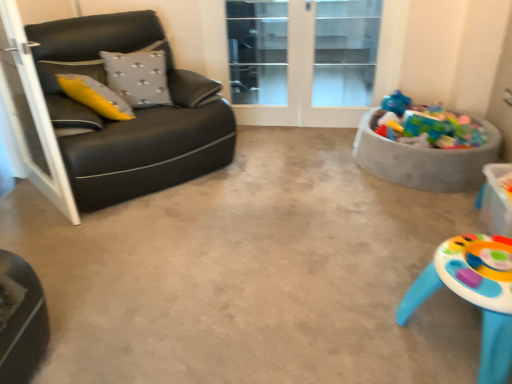
Question: Considering the relative sizes of black leather couch at left and transparent glass screen door at upper center, placed as the 1th screen door when sorted from back to front, in the image provided, is black leather couch at left shorter than transparent glass screen door at upper center, placed as the 1th screen door when sorted from back to front,?

Choices:
 (A) no
 (B) yes

Answer: (B)

Question: Is black leather couch at left next to transparent glass screen door at upper center, which ranks as the first screen door in right-to-left order, and touching it?

Choices:
 (A) yes
 (B) no

Answer: (B)

Question: Can you confirm if black leather couch at left is bigger than transparent glass screen door at upper center, placed as the 1th screen door when sorted from back to front?

Choices:
 (A) no
 (B) yes

Answer: (B)

Question: Is black leather couch at left thinner than transparent glass screen door at upper center, which is the 2th screen door from left to right?

Choices:
 (A) yes
 (B) no

Answer: (B)

Question: Is black leather couch at left not inside transparent glass screen door at upper center, which ranks as the first screen door in right-to-left order?

Choices:
 (A) yes
 (B) no

Answer: (A)

Question: Does black leather couch at left lie behind transparent glass screen door at upper center, the second screen door when ordered from front to back?

Choices:
 (A) no
 (B) yes

Answer: (A)

Question: Does matte plastic table at lower right appear on the left side of plastic colorful toys at right?

Choices:
 (A) no
 (B) yes

Answer: (B)

Question: Could plastic colorful toys at right be considered to be inside matte plastic table at lower right?

Choices:
 (A) yes
 (B) no

Answer: (B)

Question: Is matte plastic table at lower right far from plastic colorful toys at right?

Choices:
 (A) no
 (B) yes

Answer: (B)

Question: Can you confirm if matte plastic table at lower right is thinner than plastic colorful toys at right?

Choices:
 (A) yes
 (B) no

Answer: (A)

Question: Would you say matte plastic table at lower right is outside plastic colorful toys at right?

Choices:
 (A) yes
 (B) no

Answer: (A)

Question: From the image's perspective, does matte plastic table at lower right appear lower than plastic colorful toys at right?

Choices:
 (A) yes
 (B) no

Answer: (A)

Question: Is plastic colorful toys at right surrounded by transparent glass screen door at upper center, which is the 2th screen door from left to right?

Choices:
 (A) yes
 (B) no

Answer: (B)